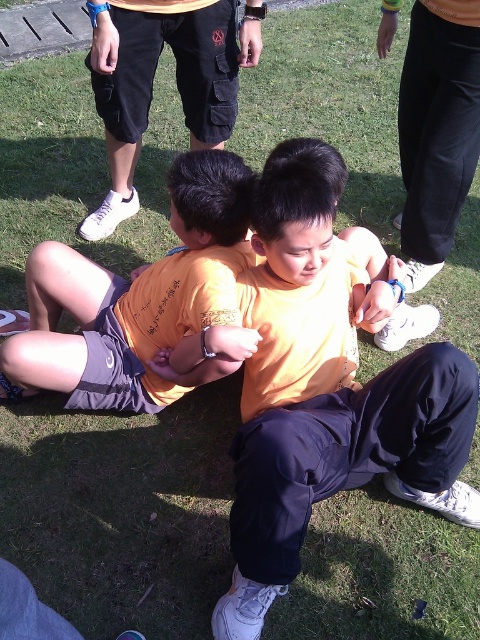
You are a delivery robot with a width of 0.8 meters. You need to move from the orange matte shirt at center to the matte black shorts at upper center. Is there enough space for you to pass through the gap between them?

The gap between orange matte shirt at center and matte black shorts at upper center is 1.05 meters. Since the robot is 0.8 meters wide, there is sufficient space for the robot to pass through the gap between them.

You are a photographer trying to capture a closeup shot of the orange matte shirt at center without the matte black shorts at upper center appearing in the frame. Based on their positions, is this possible?

The orange matte shirt at center is closer to the viewer than the matte black shorts at upper center, so you can focus on the orange matte shirt at center and exclude the matte black shorts at upper center from the frame by adjusting the camera angle or zooming in.

You are a photographer trying to capture a candid shot of the orange matte shirt at center and the matte black shorts at upper center. Based on their positions, which object should you focus on first to ensure both are in the frame?

The orange matte shirt at center is positioned under matte black shorts at upper center, so you should focus on the matte black shorts at upper center first to ensure both are in the frame.